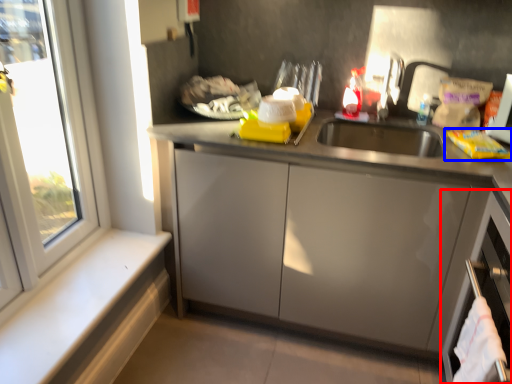
Question: Which of the following is the closest to the observer, dish washer (highlighted by a red box) or food (highlighted by a blue box)?

Choices:
 (A) dish washer
 (B) food

Answer: (A)